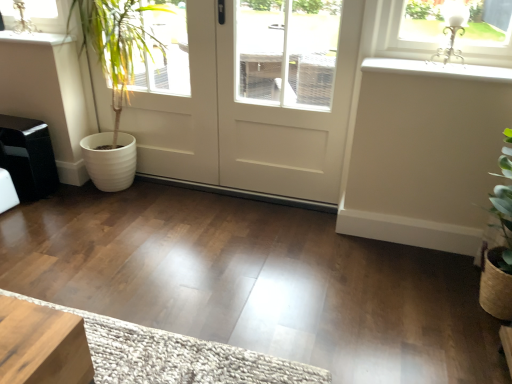
Identify the location of free point in front of white matte door at center. This screenshot has height=384, width=512. (218, 255).